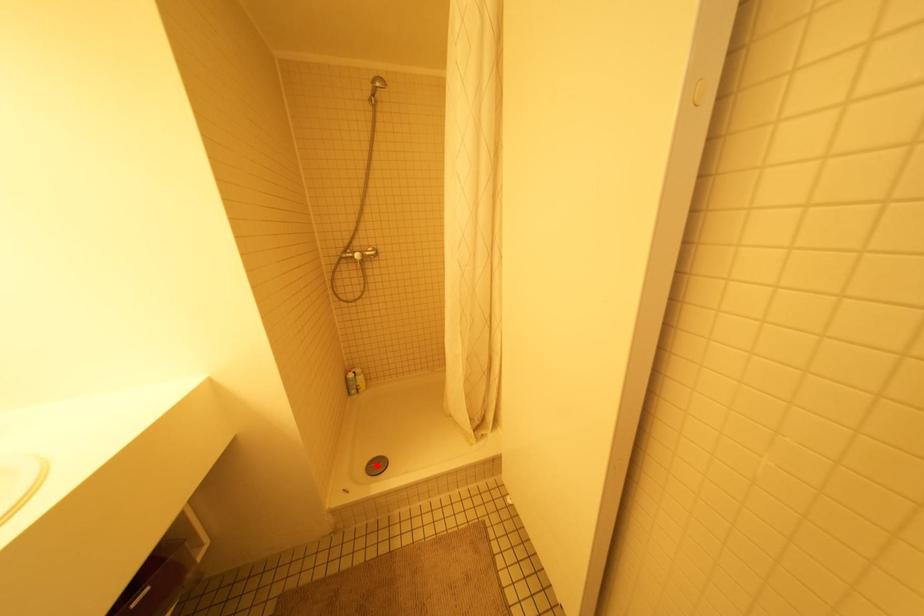
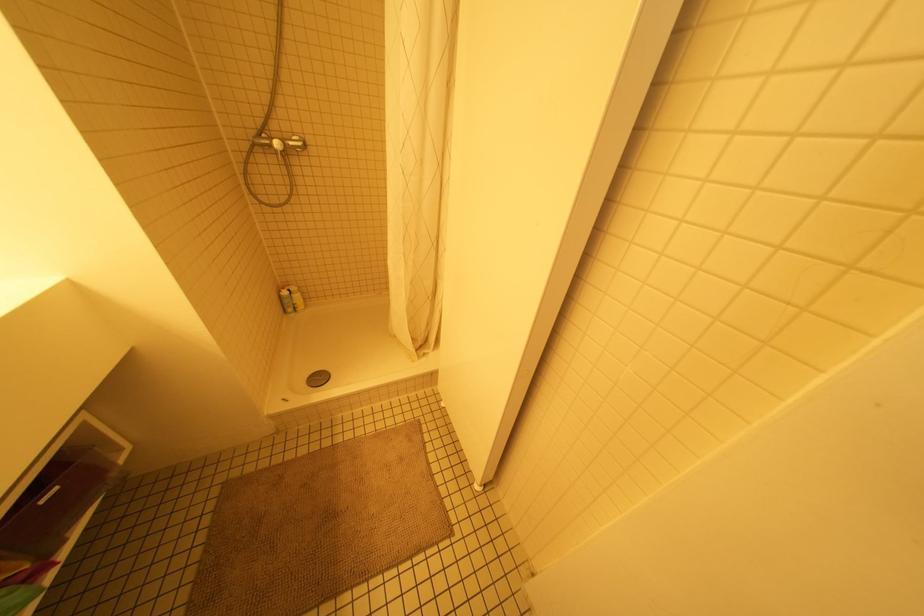
Where in the second image is the point corresponding to the highlighted location from the first image?

(319, 378)